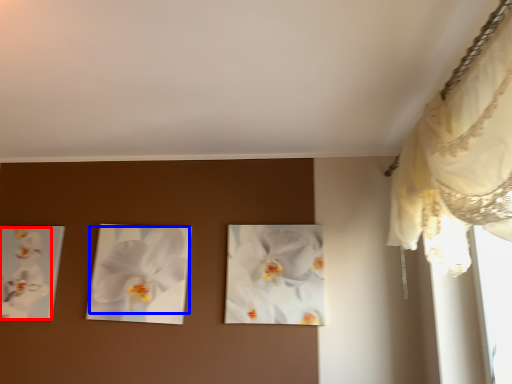
Question: Which of the following is the farthest to the observer, flower (highlighted by a red box) or flower (highlighted by a blue box)?

Choices:
 (A) flower
 (B) flower

Answer: (A)